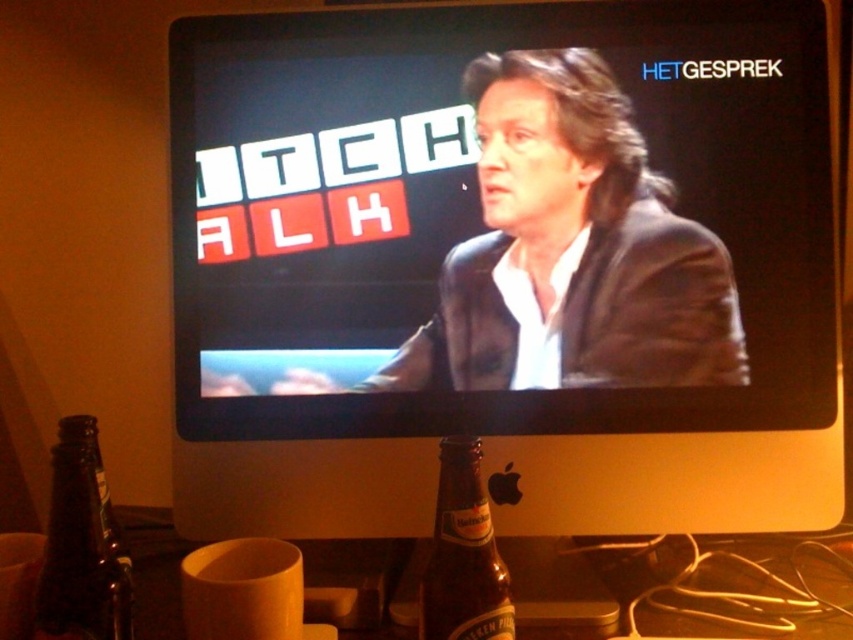
You are a bartender who needs to place a new bottle on the table in front of the computer monitor. The table has limited space. There is already a brown glass bottle at lower left represented by point (82, 547). Where should you place the new bottle to ensure it doesn not overlap with the existing one?

Place the new bottle away from the coordinates (82, 547) where the brown glass bottle at lower left is located to avoid overlapping.

You are organizing a party and need to place a decorative item on the desk. The desk has limited space. Given the items present in the scene, which object between the black glossy computer monitor at center and the brown glass bottle at lower left would you choose to move to make space, and why?

The black glossy computer monitor at center is larger in size than the brown glass bottle at lower left, so moving the brown glass bottle at lower left would free up more space on the desk.

You are a bartender who needs to place a 12.5 inch long cocktail shaker on the table between the black glossy computer monitor at center and the brown glass bottle at lower left. Can the cocktail shaker fit between them without touching either object?

The black glossy computer monitor at center and brown glass bottle at lower left are 12.79 inches apart from each other. Since the cocktail shaker is 12.5 inches long, it can fit between them as there is enough space.